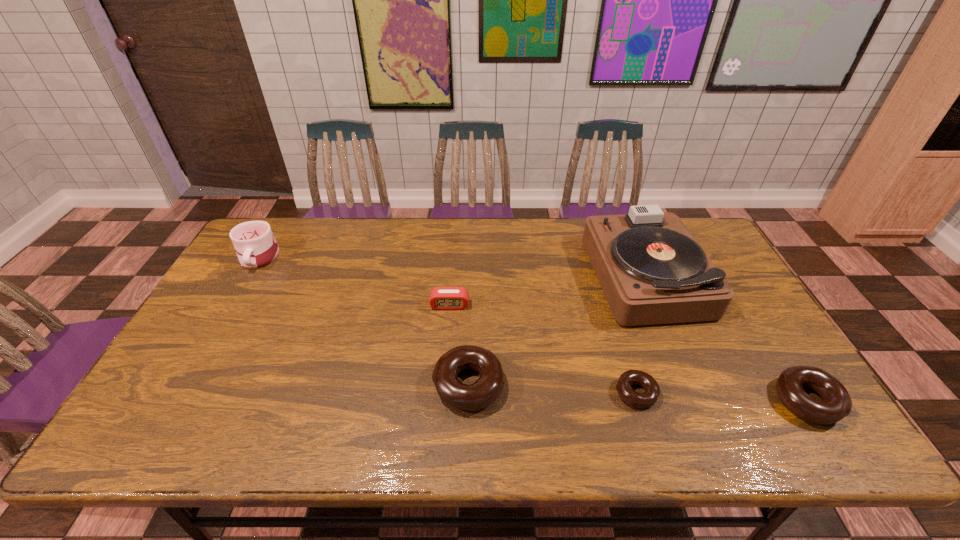
Identify which doughnut is the second nearest to the leftmost doughnut. Please provide its 2D coordinates. Your answer should be formatted as a tuple, i.e. [(x, y)], where the tuple contains the x and y coordinates of a point satisfying the conditions above.

[(836, 404)]

Where is `vacant region that satisfies the following two spatial constraints: 1. on the side with the handle of the leftmost doughnut; 2. on the left side of the mug`? The width and height of the screenshot is (960, 540). vacant region that satisfies the following two spatial constraints: 1. on the side with the handle of the leftmost doughnut; 2. on the left side of the mug is located at coordinates (184, 385).

The height and width of the screenshot is (540, 960). In order to click on vacant region that satisfies the following two spatial constraints: 1. on the side with the handle of the record player; 2. on the right side of the mug in this screenshot , I will do `click(249, 275)`.

You are a GUI agent. You are given a task and a screenshot of the screen. Output one action in this format:
    pyautogui.click(x=<x>, y=<y>)
    Task: Click on the vacant area in the image that satisfies the following two spatial constraints: 1. on the front-facing side of the leftmost doughnut; 2. on the left side of the alarm clock
    The height and width of the screenshot is (540, 960).
    Given the screenshot: What is the action you would take?
    pyautogui.click(x=444, y=385)

At what (x,y) coordinates should I click in order to perform the action: click on free space in the image that satisfies the following two spatial constraints: 1. on the front side of the shortest doughnut; 2. on the left side of the leftmost doughnut. Please return your answer as a coordinate pair (x, y). The width and height of the screenshot is (960, 540). Looking at the image, I should click on (468, 393).

Where is `free space that satisfies the following two spatial constraints: 1. on the front side of the shortest doughnut; 2. on the left side of the rightmost object`? This screenshot has height=540, width=960. free space that satisfies the following two spatial constraints: 1. on the front side of the shortest doughnut; 2. on the left side of the rightmost object is located at coordinates (638, 401).